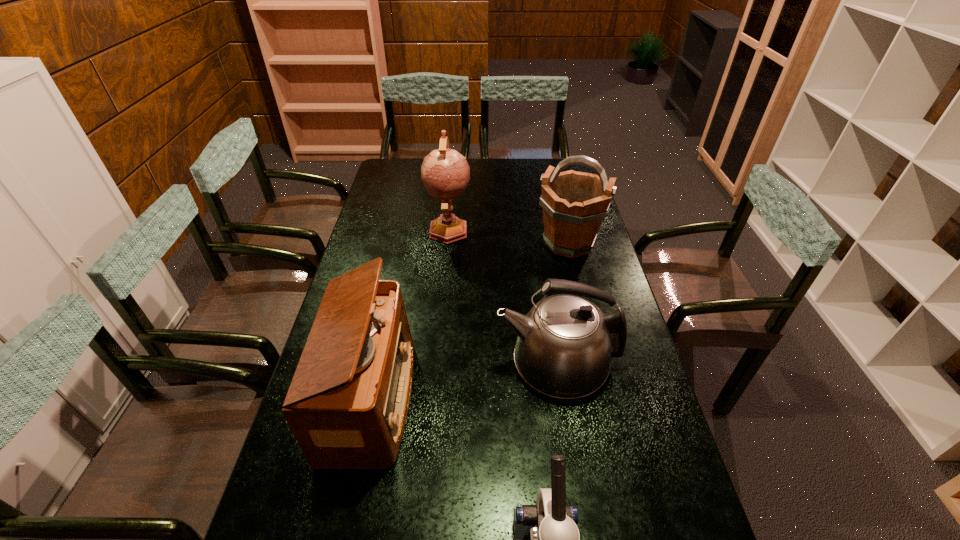
The width and height of the screenshot is (960, 540). Find the location of `object at the left edge`. object at the left edge is located at coordinates (347, 404).

What are the coordinates of `bucket that is at the right edge` in the screenshot? It's located at coord(574,204).

This screenshot has width=960, height=540. In order to click on kettle that is positioned at the right edge in this screenshot , I will do `click(565, 343)`.

Where is `free space at the left edge`? The image size is (960, 540). free space at the left edge is located at coordinates (289, 473).

You are a GUI agent. You are given a task and a screenshot of the screen. Output one action in this format:
    pyautogui.click(x=<x>, y=<y>)
    Task: Click on the free spot at the right edge of the desktop
    The width and height of the screenshot is (960, 540).
    Given the screenshot: What is the action you would take?
    pyautogui.click(x=605, y=283)

Where is `vacant space at the far left corner of the desktop`? vacant space at the far left corner of the desktop is located at coordinates (402, 180).

Image resolution: width=960 pixels, height=540 pixels. I want to click on free space between the globe and the bucket, so tap(509, 237).

The image size is (960, 540). I want to click on free spot between the bucket and the globe, so click(x=509, y=237).

Locate an element on the screen. free space between the bucket and the radio receiver is located at coordinates 470,321.

Choose which object is the nearest neighbor to the bucket. Please provide its 2D coordinates. Your answer should be formatted as a tuple, i.e. [(x, y)], where the tuple contains the x and y coordinates of a point satisfying the conditions above.

[(445, 173)]